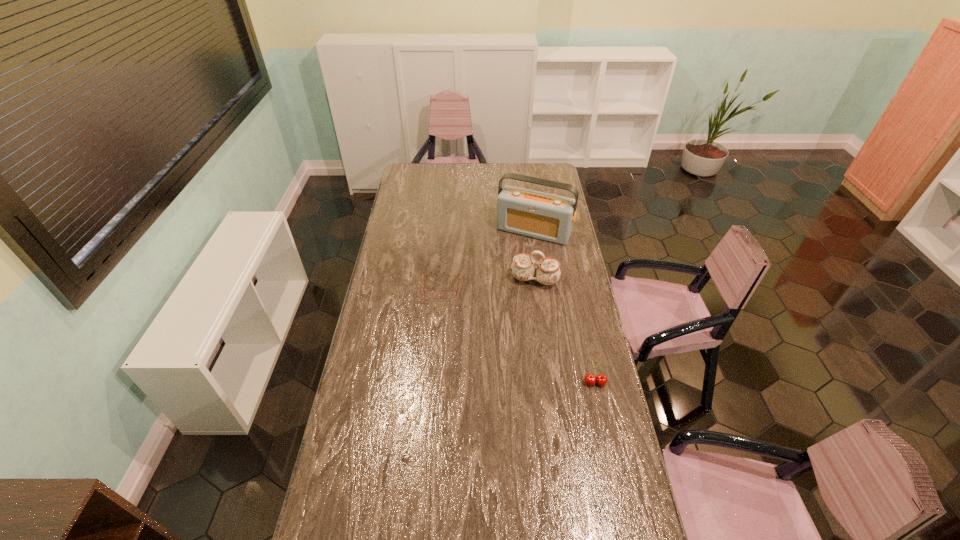
Find the location of `empty space that is in between the chinaware and the nearest object`. empty space that is in between the chinaware and the nearest object is located at coordinates (564, 331).

This screenshot has height=540, width=960. What are the coordinates of `free spot between the second shortest object and the spectacles` in the screenshot? It's located at (518, 335).

Locate an element on the screen. The height and width of the screenshot is (540, 960). object that is the second closest one to the tallest object is located at coordinates (428, 294).

I want to click on object that is the closest to the spectacles, so click(x=548, y=272).